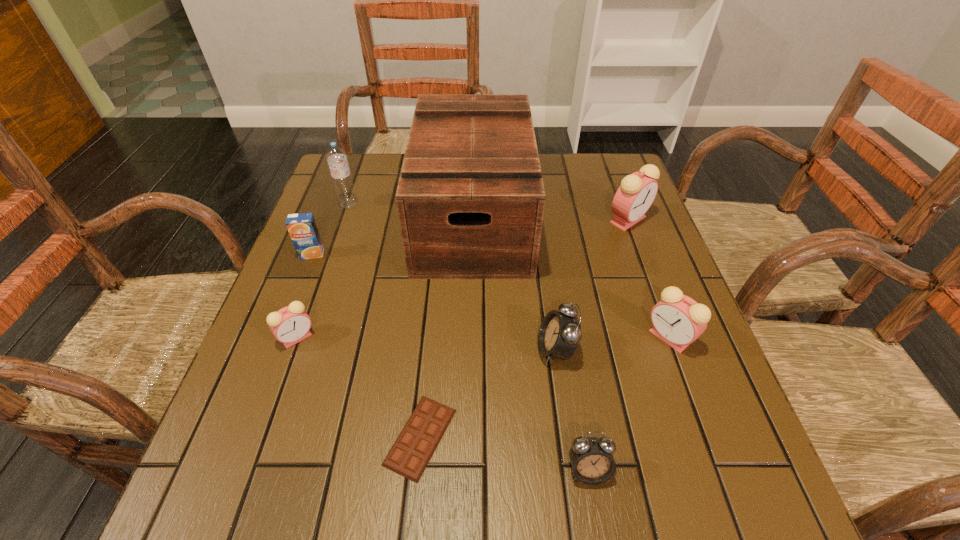
The width and height of the screenshot is (960, 540). I want to click on pink alarm clock that is the closest to the tallest object, so click(x=637, y=191).

Select which pink alarm clock is the third closest to the bigger white alarm clock. Please provide its 2D coordinates. Your answer should be formatted as a tuple, i.e. [(x, y)], where the tuple contains the x and y coordinates of a point satisfying the conditions above.

[(290, 325)]

Identify the location of vacant region that satisfies the following two spatial constraints: 1. on the face of the farthest alarm clock; 2. on the face of the bigger white alarm clock. The width and height of the screenshot is (960, 540). (677, 350).

What are the coordinates of `vacant space that satisfies the following two spatial constraints: 1. on the front side of the shortest object; 2. on the right side of the blue orange_juice` in the screenshot? It's located at (241, 437).

Where is `free space that satisfies the following two spatial constraints: 1. on the face of the farthest pink alarm clock; 2. on the face of the bigger white alarm clock`? free space that satisfies the following two spatial constraints: 1. on the face of the farthest pink alarm clock; 2. on the face of the bigger white alarm clock is located at coordinates (677, 350).

Find the location of a particular element. This screenshot has height=540, width=960. free location that satisfies the following two spatial constraints: 1. on the face of the leftmost pink alarm clock; 2. on the right side of the shortest object is located at coordinates (262, 437).